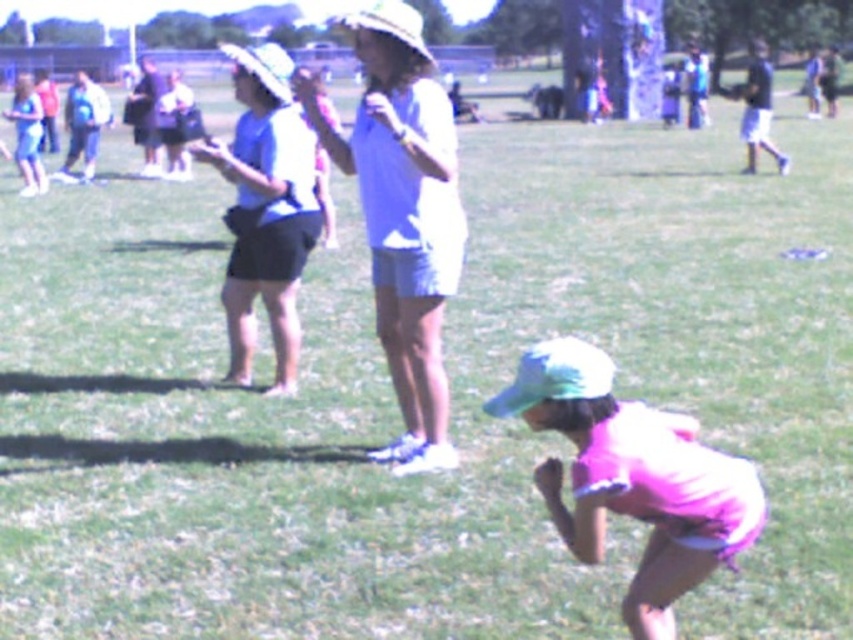
Question: Which point is farther to the camera?

Choices:
 (A) pink fabric cap at lower right
 (B) matte blue shirt at upper center
 (C) matte blue shirt at center

Answer: (B)

Question: Based on their relative distances, which object is nearer to the matte blue shirt at upper center?

Choices:
 (A) pink fabric cap at lower right
 (B) matte blue shirt at center

Answer: (B)

Question: Which of the following is the closest to the observer?

Choices:
 (A) (538, 358)
 (B) (289, 278)

Answer: (A)

Question: Can you confirm if matte blue shirt at center is wider than pink fabric cap at lower right?

Choices:
 (A) yes
 (B) no

Answer: (B)

Question: Can you confirm if pink fabric cap at lower right is wider than matte blue shirt at upper center?

Choices:
 (A) yes
 (B) no

Answer: (B)

Question: Does pink fabric cap at lower right appear under matte blue shirt at upper center?

Choices:
 (A) yes
 (B) no

Answer: (A)